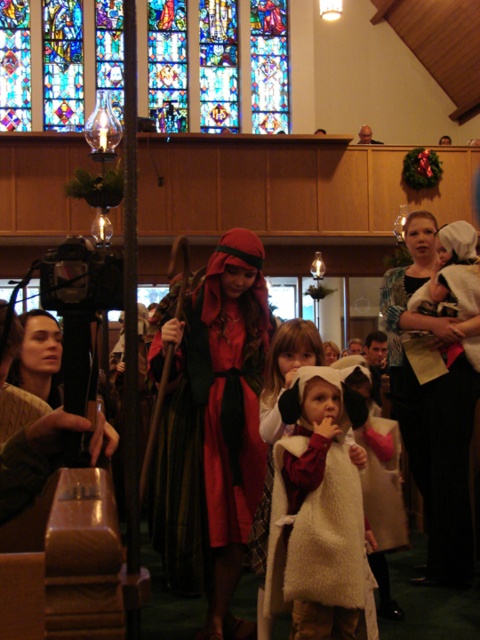
Does stained glass window at upper center have a lesser width compared to white woolen scarf at center?

Incorrect, stained glass window at upper center's width is not less than white woolen scarf at center's.

Who is lower down, stained glass window at upper center or white woolen scarf at center?

Positioned lower is white woolen scarf at center.

Where is `stained glass window at upper center`? This screenshot has width=480, height=640. stained glass window at upper center is located at coordinates (215, 65).

Where is `stained glass window at upper center`? This screenshot has width=480, height=640. stained glass window at upper center is located at coordinates (215, 65).

Find the location of a particular element. Image resolution: width=480 pixels, height=640 pixels. stained glass window at upper center is located at coordinates (215, 65).

Where is `stained glass window at upper center`? The height and width of the screenshot is (640, 480). stained glass window at upper center is located at coordinates (215, 65).

Is velvet red robe at center below white fluffy coat at center?

Actually, velvet red robe at center is above white fluffy coat at center.

Which is more to the right, velvet red robe at center or white fluffy coat at center?

white fluffy coat at center is more to the right.

Who is more forward, (220,540) or (324,488)?

Point (324,488)

Locate an element on the screen. Image resolution: width=480 pixels, height=640 pixels. velvet red robe at center is located at coordinates (226, 406).